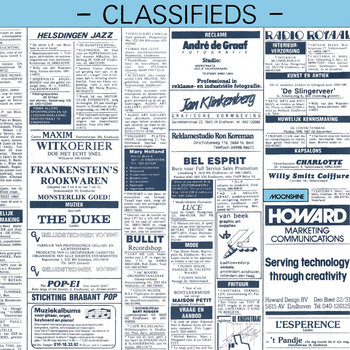
Locate an element on the screen. This screenshot has height=350, width=350. writing utensil is located at coordinates (245, 235).